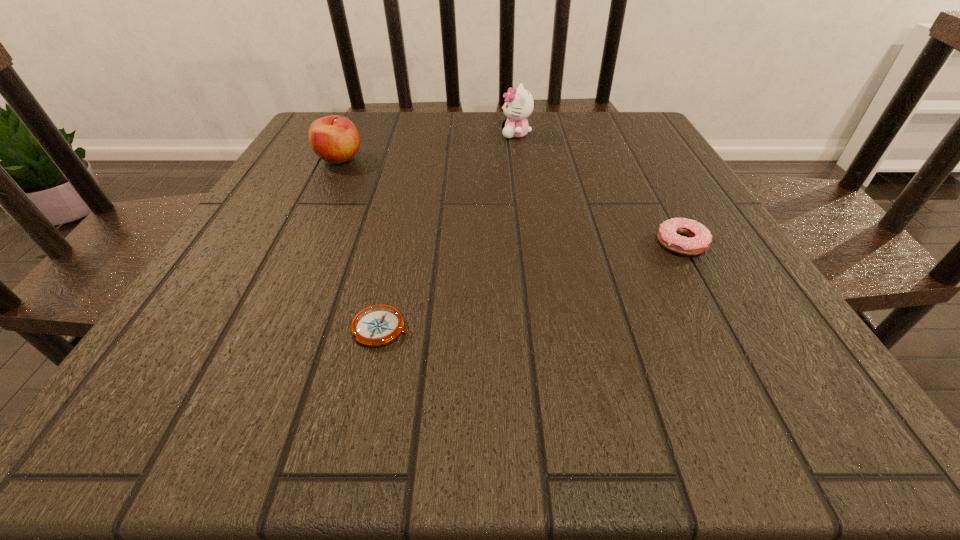
Image resolution: width=960 pixels, height=540 pixels. Identify the location of vacant space at the near edge of the desktop. (272, 368).

Locate an element on the screen. free spot at the left edge of the desktop is located at coordinates (319, 215).

Locate an element on the screen. This screenshot has height=540, width=960. free location at the right edge is located at coordinates (739, 266).

The width and height of the screenshot is (960, 540). In order to click on free location at the near left corner in this screenshot , I will do (100, 424).

This screenshot has height=540, width=960. In the image, there is a desktop. In order to click on vacant space at the far right corner in this screenshot , I will do `click(599, 129)`.

You are a GUI agent. You are given a task and a screenshot of the screen. Output one action in this format:
    pyautogui.click(x=<x>, y=<y>)
    Task: Click on the unoccupied position between the nearest object and the third farthest object
    This screenshot has width=960, height=540.
    Given the screenshot: What is the action you would take?
    pyautogui.click(x=532, y=286)

Where is `empty space that is in between the second object from left to right and the rightmost object`? The width and height of the screenshot is (960, 540). empty space that is in between the second object from left to right and the rightmost object is located at coordinates (532, 286).

Identify the location of vacant area that lies between the second object from left to right and the farthest object. (449, 231).

The height and width of the screenshot is (540, 960). What are the coordinates of `vacant space that is in between the shortest object and the farthest object` in the screenshot? It's located at (449, 231).

Locate an element on the screen. vacant point located between the third tallest object and the nearest object is located at coordinates (532, 286).